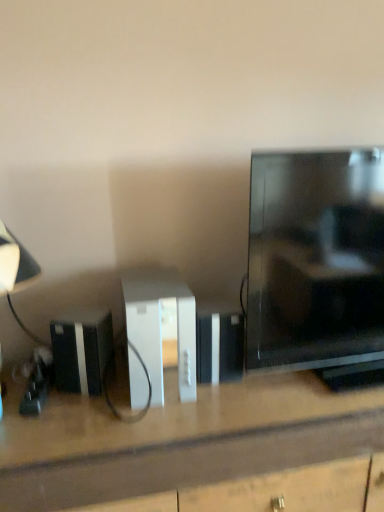
Question: Is matte black lampshade at left bigger than black plastic speaker at lower left?

Choices:
 (A) no
 (B) yes

Answer: (B)

Question: Is matte black lampshade at left shorter than black plastic speaker at lower left?

Choices:
 (A) no
 (B) yes

Answer: (A)

Question: From a real-world perspective, is matte black lampshade at left on black plastic speaker at lower left?

Choices:
 (A) yes
 (B) no

Answer: (A)

Question: Considering the relative sizes of matte black lampshade at left and black plastic speaker at lower left in the image provided, is matte black lampshade at left taller than black plastic speaker at lower left?

Choices:
 (A) no
 (B) yes

Answer: (B)

Question: Does matte black lampshade at left appear on the left side of black plastic speaker at lower left?

Choices:
 (A) yes
 (B) no

Answer: (A)

Question: Considering the positions of white matte desk at center and white plastic console at center in the image, is white matte desk at center bigger or smaller than white plastic console at center?

Choices:
 (A) big
 (B) small

Answer: (A)

Question: Would you say white matte desk at center is to the left or to the right of white plastic console at center in the picture?

Choices:
 (A) right
 (B) left

Answer: (A)

Question: Is point (112, 437) positioned closer to the camera than point (183, 328)?

Choices:
 (A) closer
 (B) farther

Answer: (A)

Question: From a real-world perspective, is white matte desk at center positioned above or below white plastic console at center?

Choices:
 (A) above
 (B) below

Answer: (B)

Question: Is matte black lampshade at left in front of or behind white plastic console at center in the image?

Choices:
 (A) behind
 (B) front

Answer: (B)

Question: Is matte black lampshade at left spatially inside white plastic console at center, or outside of it?

Choices:
 (A) inside
 (B) outside

Answer: (B)

Question: Looking at their shapes, would you say matte black lampshade at left is wider or thinner than white plastic console at center?

Choices:
 (A) wide
 (B) thin

Answer: (B)

Question: Considering the positions of matte black lampshade at left and white plastic console at center in the image, is matte black lampshade at left bigger or smaller than white plastic console at center?

Choices:
 (A) big
 (B) small

Answer: (A)

Question: Considering the positions of matte black lampshade at left and white matte desk at center in the image, is matte black lampshade at left wider or thinner than white matte desk at center?

Choices:
 (A) thin
 (B) wide

Answer: (A)

Question: Is point (38, 265) positioned closer to the camera than point (173, 426)?

Choices:
 (A) farther
 (B) closer

Answer: (A)